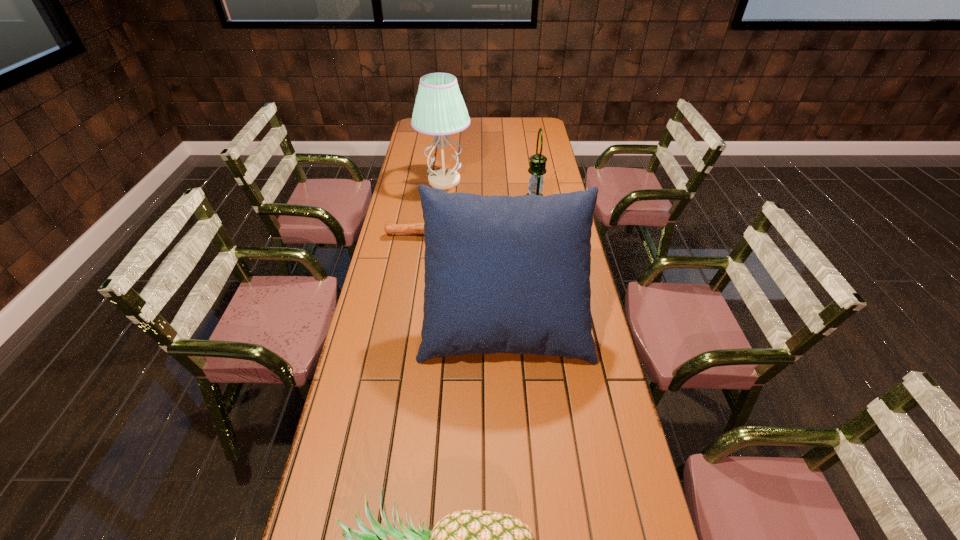
In order to click on lamp in this screenshot , I will do `click(439, 109)`.

Locate an element on the screen. The width and height of the screenshot is (960, 540). cushion is located at coordinates (503, 274).

Image resolution: width=960 pixels, height=540 pixels. Find the location of `lantern`. lantern is located at coordinates (537, 169).

Where is `mallet`? mallet is located at coordinates (417, 228).

You are a GUI agent. You are given a task and a screenshot of the screen. Output one action in this format:
    pyautogui.click(x=<x>, y=<y>)
    Task: Click on the third farthest object
    
    Given the screenshot: What is the action you would take?
    pyautogui.click(x=417, y=228)

Identify the location of vacant region located on the right of the lamp. (500, 181).

Locate an element on the screen. The width and height of the screenshot is (960, 540). vacant space situated 0.050m on the facing side of the fourth farthest object is located at coordinates (509, 383).

Where is `free space located 0.120m on the side where the lantern emits light`? free space located 0.120m on the side where the lantern emits light is located at coordinates (492, 205).

At what (x,y) coordinates should I click in order to perform the action: click on blank space located on the side where the lantern emits light. Please return your answer as a coordinate pair (x, y). This screenshot has height=540, width=960. Looking at the image, I should click on (483, 205).

Locate an element on the screen. This screenshot has width=960, height=540. vacant region located on the side where the lantern emits light is located at coordinates (450, 205).